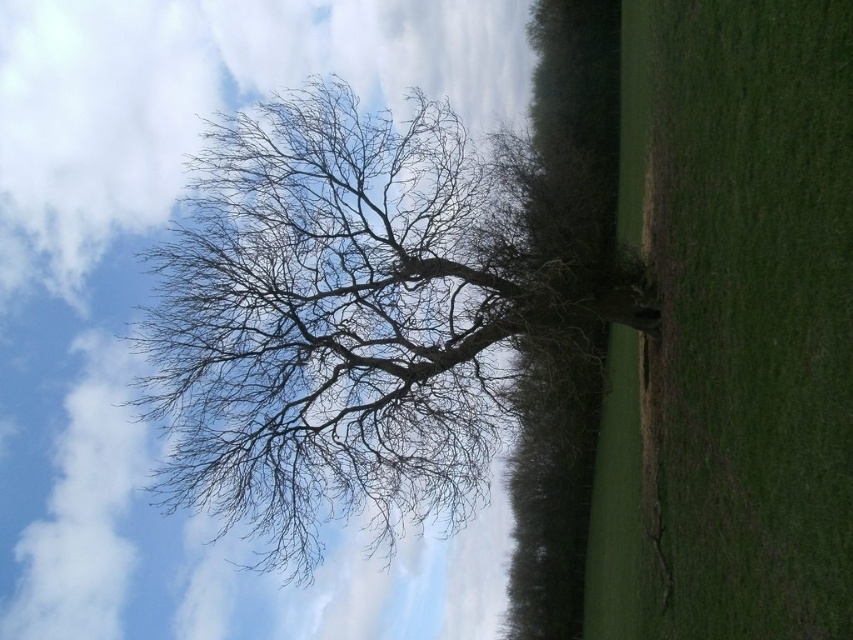
You are a landscape architect designing a new park. You need to place a small garden bench between the bare branches at center and the green grassy field at center. Which object should the bench be closer to if the bench requires more space on the side with the wider object?

The bench should be placed closer to the bare branches at center because its width is larger than the green grassy field at center, providing more space for the bench.

You are a gardener planning to mow the green grassy field at center. You notice the bare branches at center. Which direction should you avoid mowing to prevent damaging the tree?

The bare branches at center is positioned on the left side of green grassy field at center, so you should avoid mowing the left side of the green grassy field at center to prevent damaging the tree.